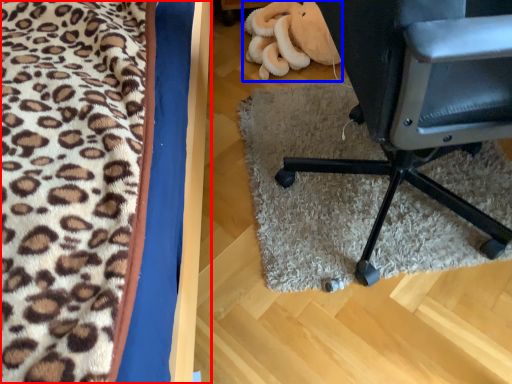
Question: Which object appears farthest to the camera in this image, furniture (highlighted by a red box) or stuff (highlighted by a blue box)?

Choices:
 (A) furniture
 (B) stuff

Answer: (B)